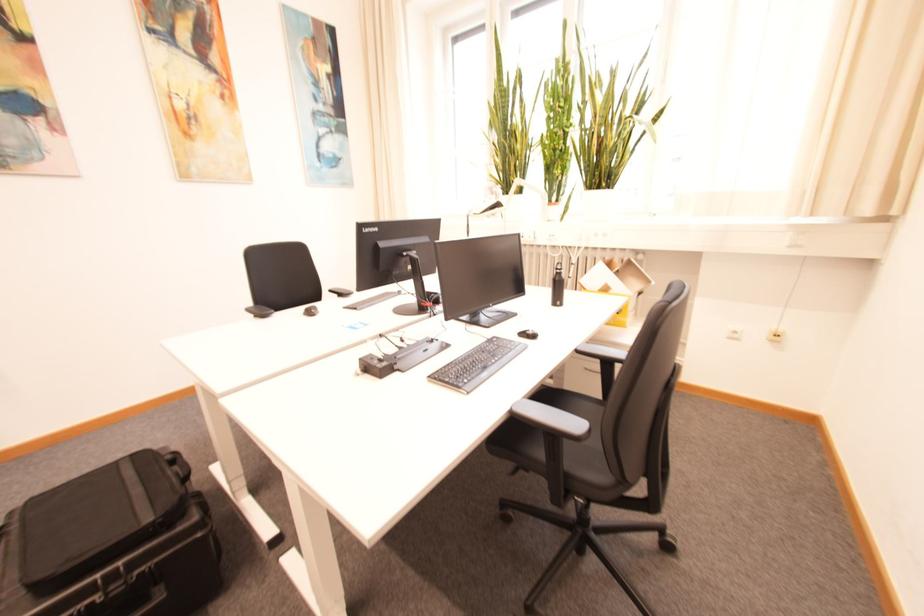
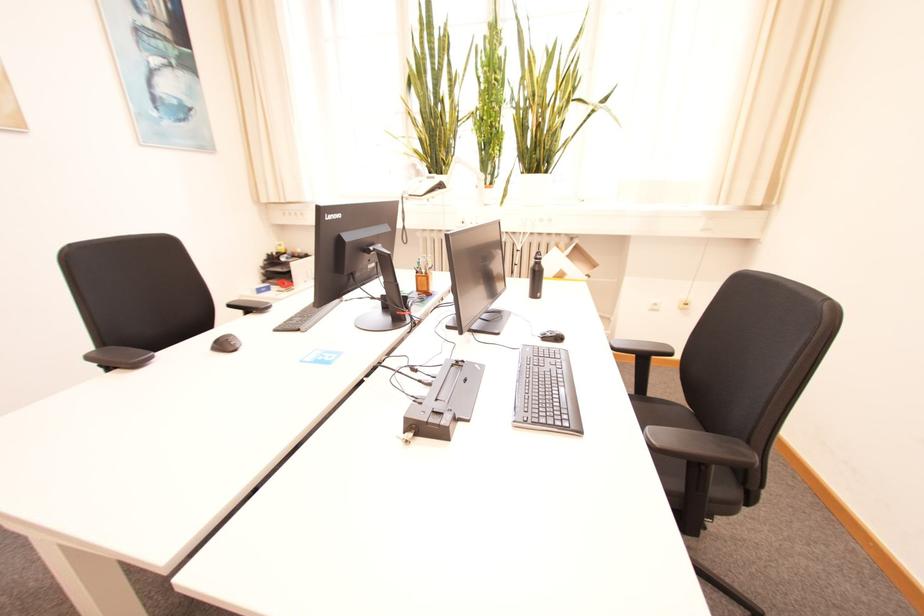
Locate, in the second image, the point that corresponds to [317,313] in the first image.

(229, 346)